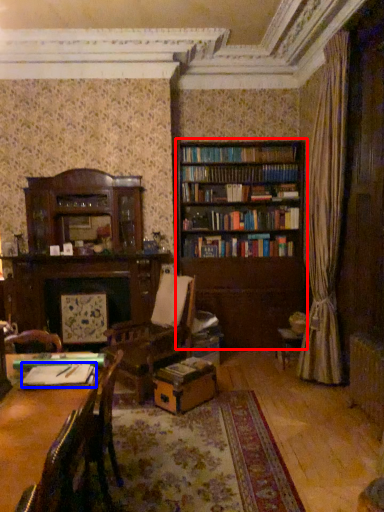
Question: Which point is further to the camera, bookcase (highlighted by a red box) or book (highlighted by a blue box)?

Choices:
 (A) bookcase
 (B) book

Answer: (A)